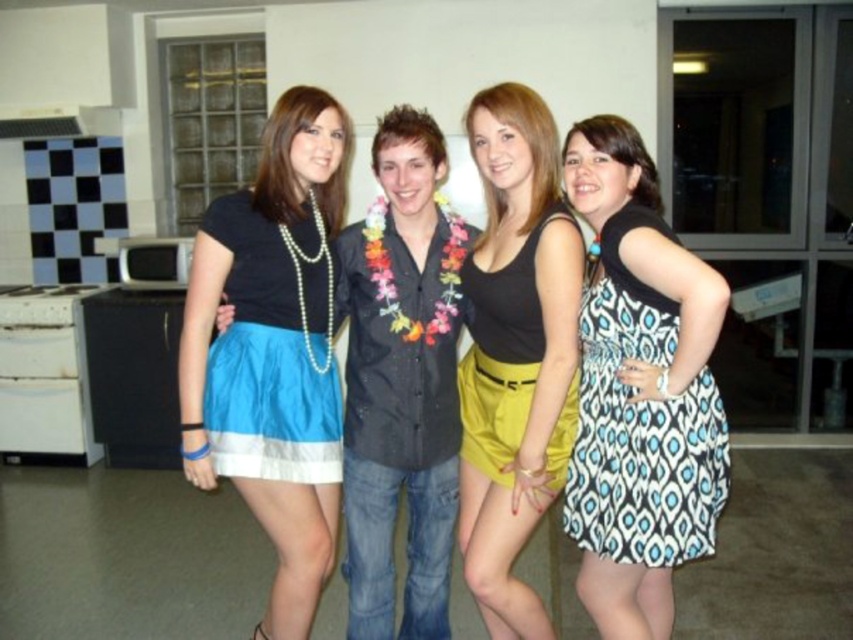
You are standing in the room where the group is posing. You want to move from your current position to the point marked as point (242,285). However, there is an obstacle at point (555,433). Can you walk directly to your destination without going around the obstacle?

Point (555,433) is in front of point (242,285), so you cannot walk directly to point (242,285) without going around the obstacle at point (555,433).

You are standing in the room and want to find the black and white patterned dress at right. According to the coordinates provided, where should you look to locate it?

The black and white patterned dress at right is located at coordinates point (640,422), so you should look towards the lower right area of the image to find it.